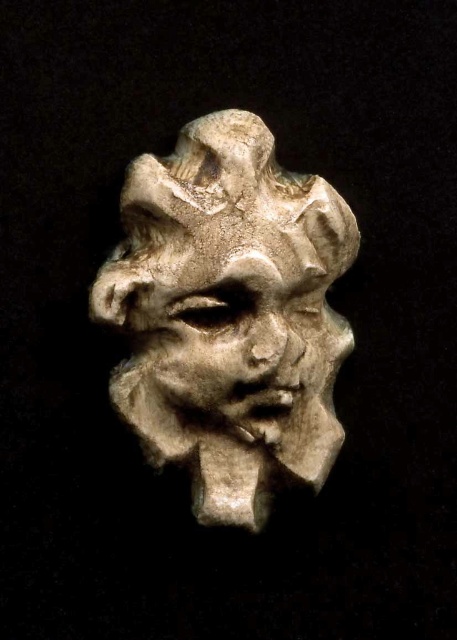
Is matte stone sculpture at center behind matte stone face at center?

No, it is not.

Describe the element at coordinates (228, 316) in the screenshot. The width and height of the screenshot is (457, 640). I see `matte stone sculpture at center` at that location.

Describe the element at coordinates (228, 316) in the screenshot. This screenshot has height=640, width=457. I see `matte stone sculpture at center` at that location.

Where is `matte stone sculpture at center`? matte stone sculpture at center is located at coordinates (228, 316).